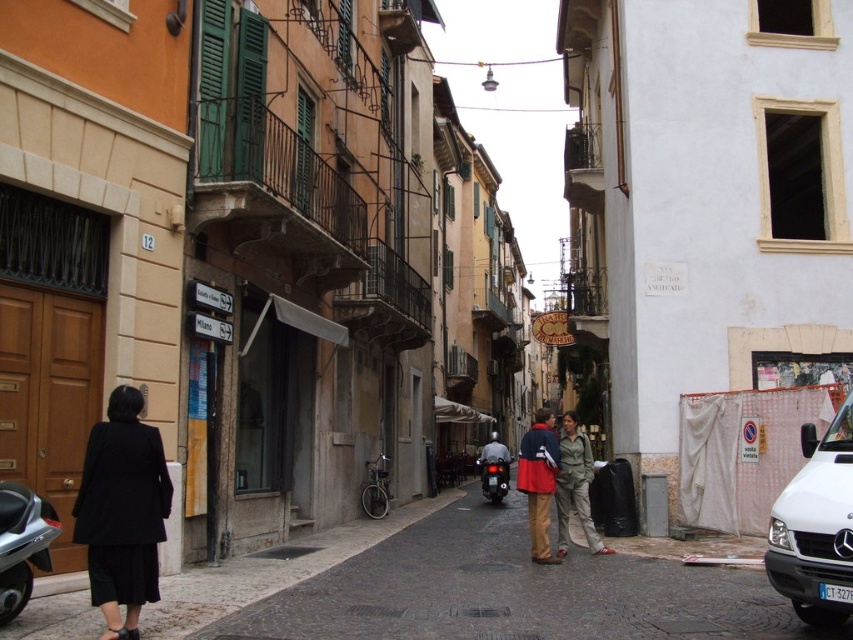
You are a delivery person who needs to load a package onto the matte black scooter at center. The package requires that the scooter must be taller than the khaki cotton pants at center. Can you load the package?

The matte black scooter at center is shorter than the khaki cotton pants at center. Since the package requires the scooter to be taller, you cannot load the package.

You are a tourist in this European town and want to take a photo of the woman in the scene. The camera you have can only focus on objects that are at the same height. Since you want both the black wool coat at lower left and the khaki cotton pants at center in focus, will the camera be able to capture both clearly?

The black wool coat at lower left is above the khaki cotton pants at center, so they are at different heights. Since the camera can only focus on objects at the same height, it will not be able to capture both clearly.